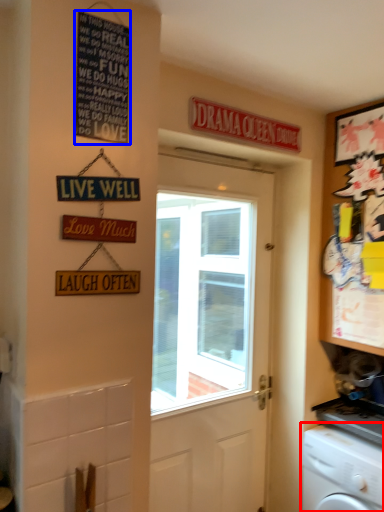
Question: Which object is closer to the camera taking this photo, washing machine (highlighted by a red box) or signage (highlighted by a blue box)?

Choices:
 (A) washing machine
 (B) signage

Answer: (B)